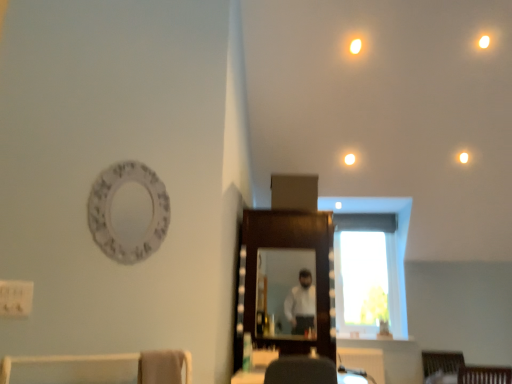
Describe the element at coordinates (368, 273) in the screenshot. This screenshot has height=384, width=512. I see `transparent glass window at center` at that location.

Measure the distance between white textured plate at upper left and camera.

A distance of 2.06 meters exists between white textured plate at upper left and camera.

What do you see at coordinates (355, 46) in the screenshot?
I see `white glossy light at upper center, the second lighting from the bottom` at bounding box center [355, 46].

Image resolution: width=512 pixels, height=384 pixels. I want to click on white glossy light at upper center, so (x=349, y=159).

You are a GUI agent. You are given a task and a screenshot of the screen. Output one action in this format:
    pyautogui.click(x=<x>, y=<y>)
    Task: Click on the transparent glass window at center
    This screenshot has width=512, height=384.
    Given the screenshot: What is the action you would take?
    pyautogui.click(x=368, y=273)

Between transparent glass window at center and matte wooden mirror at center, the 1th mirror positioned from the back, which one has more height?

transparent glass window at center is taller.

Is transparent glass window at center at the left side of matte wooden mirror at center, the 1th mirror positioned from the back?

No.

Which point is more forward, (x=335, y=247) or (x=307, y=316)?

The point (x=307, y=316) is closer to the camera.

From the image's perspective, which one is positioned lower, transparent glass window at center or matte wooden mirror at center, the second mirror viewed from the front?

transparent glass window at center appears lower in the image.

Looking at their sizes, would you say white textured plate at upper left is wider or thinner than white glossy light at upper center, acting as the 1th lighting starting from the top?

Considering their sizes, white textured plate at upper left looks broader than white glossy light at upper center, acting as the 1th lighting starting from the top.

From the image's perspective, would you say white textured plate at upper left is positioned over white glossy light at upper center, which ranks as the 2th lighting in right-to-left order?

No, from the image's perspective, white textured plate at upper left is not above white glossy light at upper center, which ranks as the 2th lighting in right-to-left order.

Is point (116, 230) farther from camera compared to point (351, 50)?

No, (116, 230) is in front of (351, 50).

Identify the location of oval lying below the white glossy light at upper center, marked as the 1th lighting in a left-to-right arrangement (from the image's perspective). (128, 212).

From a real-world perspective, is white glossy light at upper center, acting as the 1th lighting starting from the top, below white glossy light at upper center?

No.

Can you confirm if white glossy light at upper center, marked as the 1th lighting in a front-to-back arrangement, is positioned to the left of white glossy light at upper center?

Indeed, white glossy light at upper center, marked as the 1th lighting in a front-to-back arrangement, is positioned on the left side of white glossy light at upper center.

Is white glossy light at upper center, the second lighting when ordered from back to front, surrounding white glossy light at upper center?

No, white glossy light at upper center is not a part of white glossy light at upper center, the second lighting when ordered from back to front.

Are white glossy light at upper center, which ranks as the 2th lighting in right-to-left order, and white glossy light at upper center making contact?

They are not placed beside each other.

Consider the image. How far apart are transparent glass window at center and wooden mirror at center, which is the 1th mirror in front-to-back order?

transparent glass window at center and wooden mirror at center, which is the 1th mirror in front-to-back order, are 6.46 feet apart from each other.

Is point (337, 275) closer or farther from the camera than point (241, 323)?

Point (337, 275) is positioned farther from the camera compared to point (241, 323).

From a real-world perspective, which object stands above the other?

transparent glass window at center is physically above.

From the picture: Considering the sizes of objects transparent glass window at center and wooden mirror at center, which is the 1th mirror in front-to-back order, in the image provided, who is taller, transparent glass window at center or wooden mirror at center, which is the 1th mirror in front-to-back order,?

wooden mirror at center, which is the 1th mirror in front-to-back order.

At what (x,y) coordinates should I click in order to perform the action: click on lighting above the warm matte light bulb at upper right, positioned as the 2th lighting in top-to-bottom order (from a real-world perspective). Please return your answer as a coordinate pair (x, y). The width and height of the screenshot is (512, 384). Looking at the image, I should click on (355, 46).

Does warm matte light bulb at upper right, the 1th lighting positioned from the bottom, have a smaller size compared to white glossy light at upper center, which ranks as the 2th lighting in right-to-left order?

Indeed, warm matte light bulb at upper right, the 1th lighting positioned from the bottom, has a smaller size compared to white glossy light at upper center, which ranks as the 2th lighting in right-to-left order.

Is white glossy light at upper center, acting as the 1th lighting starting from the top, at the back of warm matte light bulb at upper right, the first lighting viewed from the right?

warm matte light bulb at upper right, the first lighting viewed from the right, is not turned away from white glossy light at upper center, acting as the 1th lighting starting from the top.

From a real-world perspective, who is located lower, warm matte light bulb at upper right, the first lighting viewed from the right, or white glossy light at upper center, acting as the 1th lighting starting from the top?

warm matte light bulb at upper right, the first lighting viewed from the right, from a real-world perspective.

Would you consider transparent glass window at center to be distant from warm matte light bulb at upper right, the second lighting in the front-to-back sequence?

Indeed, transparent glass window at center is not near warm matte light bulb at upper right, the second lighting in the front-to-back sequence.

Considering the sizes of objects transparent glass window at center and warm matte light bulb at upper right, positioned as the 2th lighting in top-to-bottom order, in the image provided, who is thinner, transparent glass window at center or warm matte light bulb at upper right, positioned as the 2th lighting in top-to-bottom order,?

Thinner between the two is warm matte light bulb at upper right, positioned as the 2th lighting in top-to-bottom order.

Measure the distance between transparent glass window at center and warm matte light bulb at upper right, the second lighting in the front-to-back sequence.

A distance of 1.69 meters exists between transparent glass window at center and warm matte light bulb at upper right, the second lighting in the front-to-back sequence.

Considering the sizes of objects transparent glass window at center and warm matte light bulb at upper right, the 1th lighting positioned from the bottom, in the image provided, who is bigger, transparent glass window at center or warm matte light bulb at upper right, the 1th lighting positioned from the bottom,?

transparent glass window at center.

Identify the location of window below the white glossy light at upper center (from the image's perspective). Image resolution: width=512 pixels, height=384 pixels. 368,273.

Does point (352, 155) lie behind point (382, 313)?

No, (352, 155) is in front of (382, 313).

Considering the relative sizes of white glossy light at upper center and transparent glass window at center in the image provided, is white glossy light at upper center thinner than transparent glass window at center?

Yes.

Measure the distance between white glossy light at upper center and transparent glass window at center.

A distance of 1.57 meters exists between white glossy light at upper center and transparent glass window at center.

At what (x,y) coordinates should I click in order to perform the action: click on window below the matte wooden mirror at center, the second mirror viewed from the front (from the image's perspective). Please return your answer as a coordinate pair (x, y). Image resolution: width=512 pixels, height=384 pixels. Looking at the image, I should click on (368, 273).

Locate an element on the screen. the 1st lighting behind the white textured plate at upper left is located at coordinates (355, 46).

Which object lies nearer to the anchor point white glossy light at upper center, white textured plate at upper left or matte wooden mirror at center, the 1th mirror positioned from the back?

matte wooden mirror at center, the 1th mirror positioned from the back, is closer to white glossy light at upper center.

Which object lies further to the anchor point white glossy light at upper center, warm matte light bulb at upper right, which appears as the first lighting when viewed from the back, or transparent glass window at center?

transparent glass window at center.

Looking at the image, which one is located closer to matte wooden mirror at center, the second mirror viewed from the front, wooden mirror at center, which is the 1th mirror in front-to-back order, or white glossy light at upper center, the second lighting from the bottom?

The object closer to matte wooden mirror at center, the second mirror viewed from the front, is wooden mirror at center, which is the 1th mirror in front-to-back order.

Based on their spatial positions, is transparent glass window at center or wooden mirror at center, which is the 1th mirror in front-to-back order, further from white glossy light at upper center, the second lighting when ordered from back to front?

transparent glass window at center is further to white glossy light at upper center, the second lighting when ordered from back to front.

Considering their positions, is white textured plate at upper left positioned further to matte wooden mirror at center, the second mirror viewed from the front, than wooden mirror at center, which is the 1th mirror in front-to-back order?

white textured plate at upper left lies further to matte wooden mirror at center, the second mirror viewed from the front, than the other object.

From the image, which object appears to be nearer to white textured plate at upper left, warm matte light bulb at upper right, the first lighting viewed from the right, or white glossy light at upper center, acting as the 1th lighting starting from the top?

Among the two, white glossy light at upper center, acting as the 1th lighting starting from the top, is located nearer to white textured plate at upper left.

Based on their spatial positions, is warm matte light bulb at upper right, the first lighting viewed from the right, or white glossy light at upper center closer to transparent glass window at center?

Among the two, white glossy light at upper center is located nearer to transparent glass window at center.

Based on the photo, estimate the real-world distances between objects in this image. Which object is closer to matte wooden mirror at center, the 1th mirror positioned from the back, white glossy light at upper center, marked as the 1th lighting in a left-to-right arrangement, or wooden mirror at center, which is the 1th mirror in front-to-back order?

wooden mirror at center, which is the 1th mirror in front-to-back order, lies closer to matte wooden mirror at center, the 1th mirror positioned from the back, than the other object.

Where is `mirror positioned between wooden mirror at center, the 2th mirror positioned from the back, and transparent glass window at center from near to far`? This screenshot has width=512, height=384. mirror positioned between wooden mirror at center, the 2th mirror positioned from the back, and transparent glass window at center from near to far is located at coordinates (285, 292).

Locate an element on the screen. The width and height of the screenshot is (512, 384). lighting between white glossy light at upper center, acting as the 1th lighting starting from the top, and transparent glass window at center vertically is located at coordinates (463, 157).

Find the location of a particular element. This screenshot has width=512, height=384. light between wooden mirror at center, which is the 1th mirror in front-to-back order, and warm matte light bulb at upper right, the first lighting viewed from the right, from left to right is located at coordinates pos(349,159).

Identify the location of light located between matte wooden mirror at center, the 1th mirror positioned from the back, and transparent glass window at center in the depth direction. (349, 159).